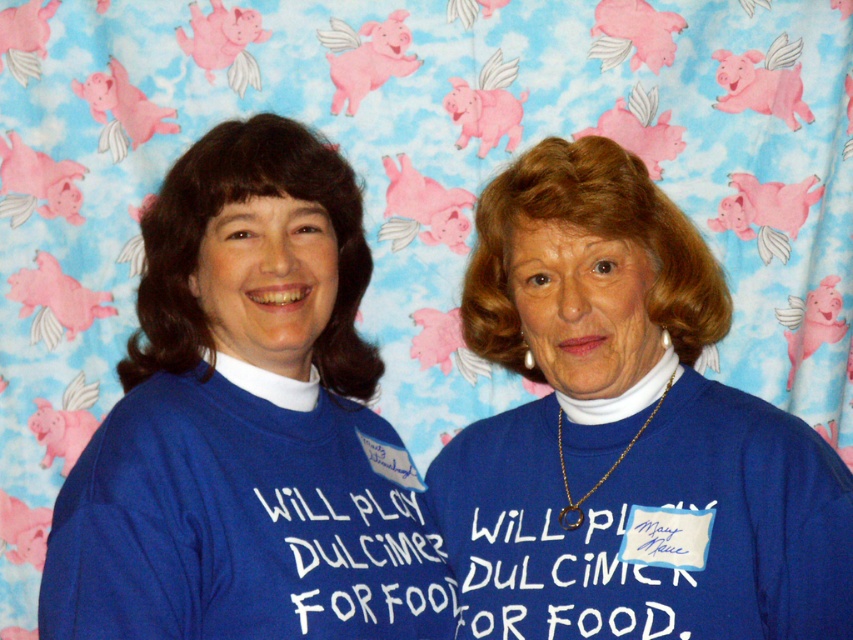
Question: Can you confirm if blue cotton shirt at center is wider than blue matte shirt at center?

Choices:
 (A) yes
 (B) no

Answer: (A)

Question: From the image, what is the correct spatial relationship of blue cotton shirt at center in relation to blue matte shirt at center?

Choices:
 (A) left
 (B) right

Answer: (B)

Question: Which of the following is the farthest from the observer?

Choices:
 (A) blue matte shirt at center
 (B) blue cotton shirt at center

Answer: (B)

Question: Can you confirm if blue cotton shirt at center is thinner than blue matte shirt at center?

Choices:
 (A) yes
 (B) no

Answer: (B)

Question: Which object appears farthest from the camera in this image?

Choices:
 (A) blue matte shirt at center
 (B) blue cotton shirt at center

Answer: (B)